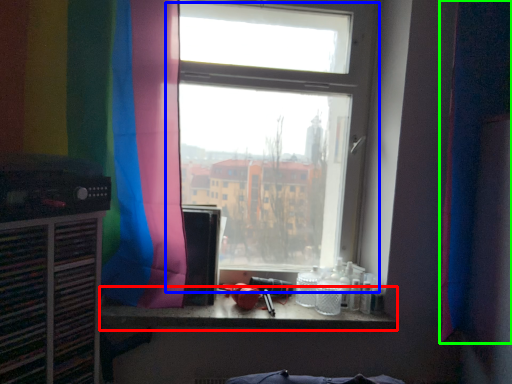
Question: Which is nearer to the counter top (highlighted by a red box)? window (highlighted by a blue box) or curtain (highlighted by a green box).

Choices:
 (A) window
 (B) curtain

Answer: (A)